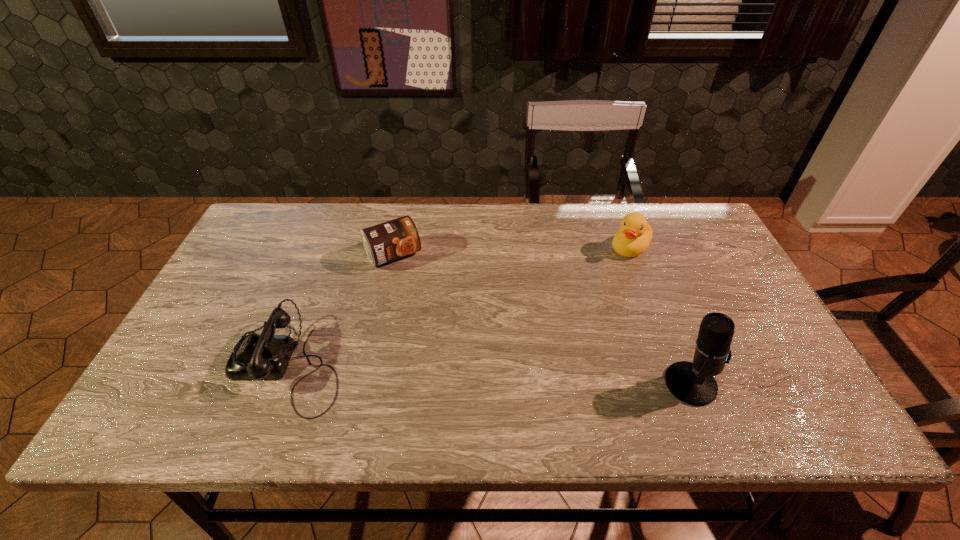
Find the location of `telephone`. telephone is located at coordinates (255, 357).

I want to click on the tallest object, so click(x=693, y=383).

In order to click on duck in this screenshot , I will do 634,237.

What are the coordinates of `can` in the screenshot? It's located at (385, 242).

Locate an element on the screen. free region located on the front-facing side of the telephone is located at coordinates (207, 363).

Locate an element on the screen. Image resolution: width=960 pixels, height=540 pixels. free space located on the front-facing side of the telephone is located at coordinates (186, 363).

Find the location of a particular element. vacant region located 0.080m on the right of the microphone is located at coordinates (751, 384).

Find the location of `free space located at the beak of the third shortest object`. free space located at the beak of the third shortest object is located at coordinates (551, 320).

Identify the location of free spot located at the beak of the third shortest object. Image resolution: width=960 pixels, height=540 pixels. (585, 289).

At what (x,y) coordinates should I click in order to perform the action: click on vacant region located 0.220m at the beak of the third shortest object. Please return your answer as a coordinate pair (x, y). Looking at the image, I should click on (576, 298).